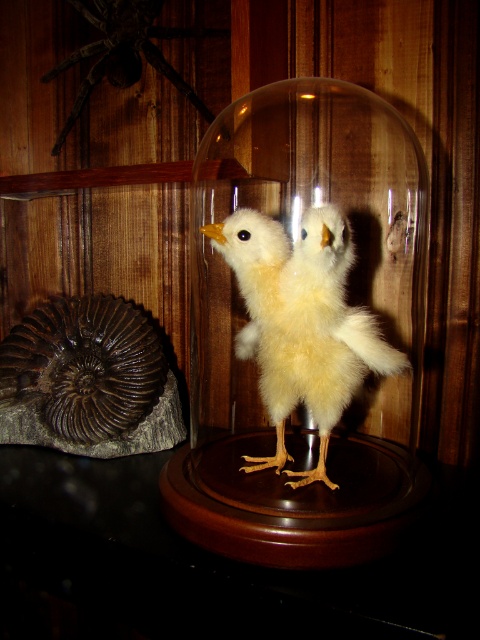
Is yellow fluffy chicken at center positioned before dark brown fuzzy spider at upper left?

Yes.

Is yellow fluffy chicken at center smaller than dark brown fuzzy spider at upper left?

No.

Who is more forward, (323, 276) or (134, 77)?

Point (323, 276) is in front.

At what (x,y) coordinates should I click in order to perform the action: click on yellow fluffy chicken at center. Please return your answer as a coordinate pair (x, y). Looking at the image, I should click on (301, 323).